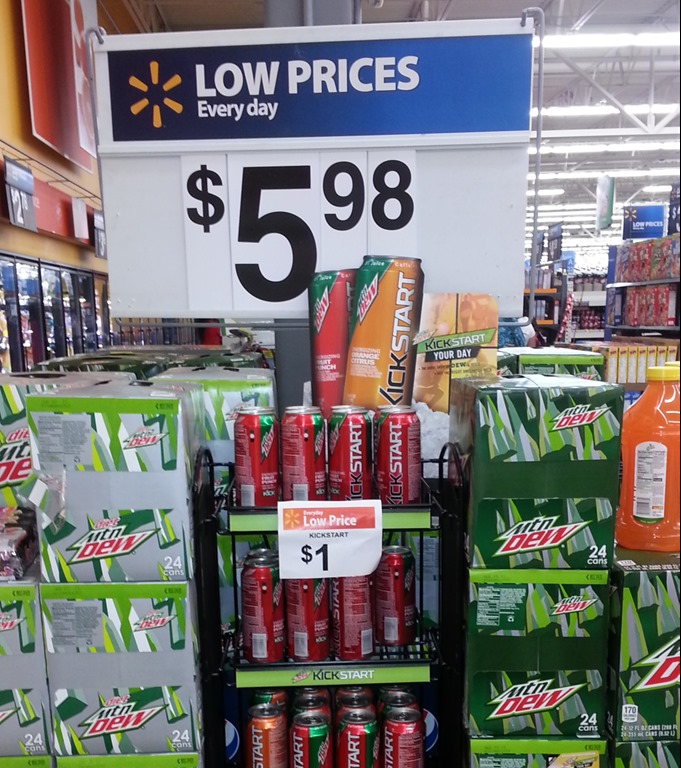
Identify the location of 3 shelves of cans of kickstart. (379, 465), (378, 611), (370, 733).